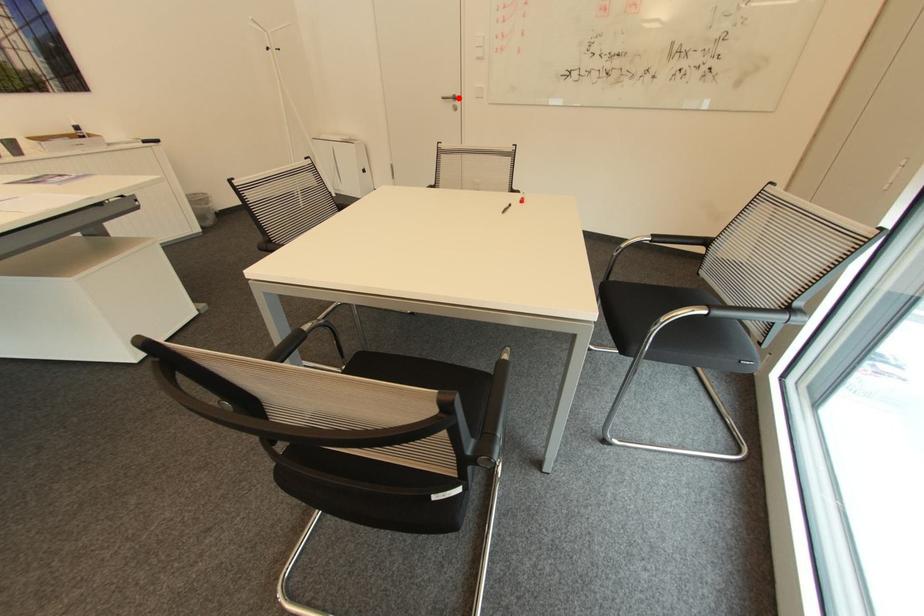
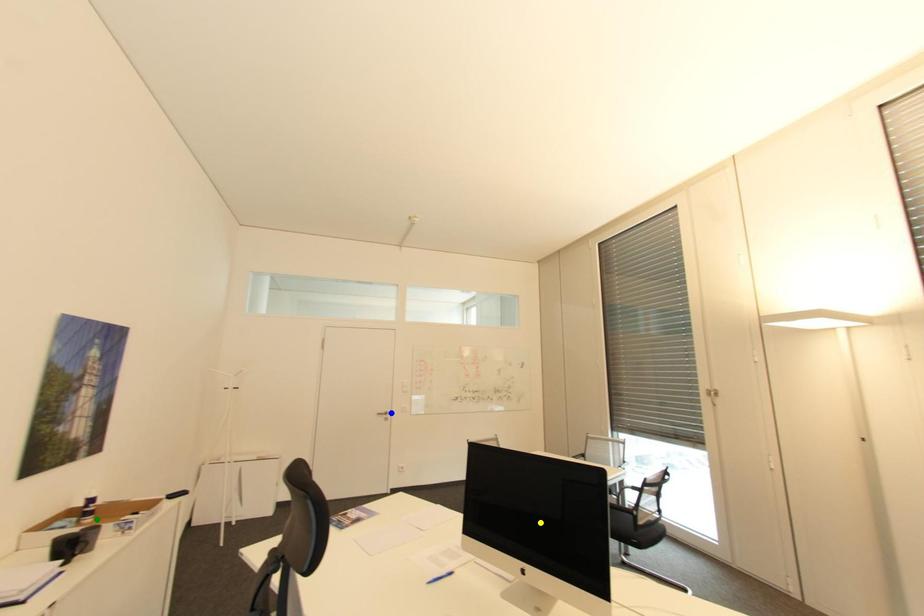
Question: I am providing you with two images of the same scene from different viewpoints. A red point is marked on the first image. You are given multiple points on the second image. Which point in image 2 represents the same 3d spot as the red point in image 1?

Choices:
 (A) green point
 (B) blue point
 (C) yellow point

Answer: (B)